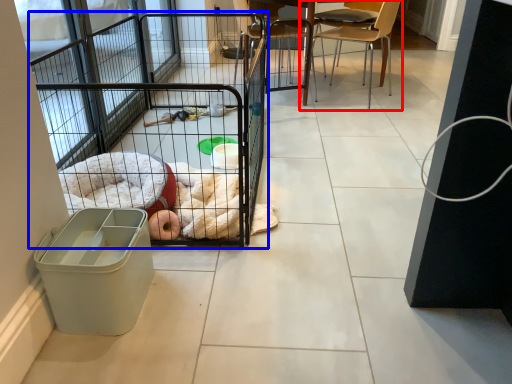
Question: Among these objects, which one is nearest to the camera, chair (highlighted by a red box) or cage (highlighted by a blue box)?

Choices:
 (A) chair
 (B) cage

Answer: (B)